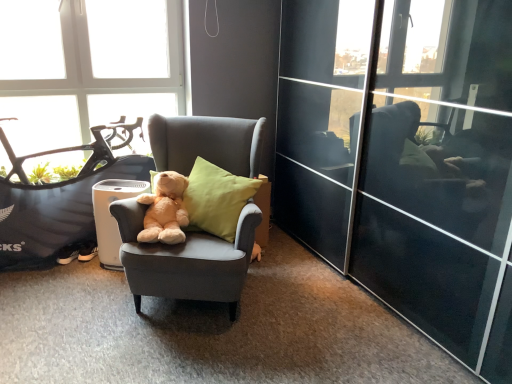
Question: Is transparent glass window at upper left inside the boundaries of matte gray armchair at center, or outside?

Choices:
 (A) outside
 (B) inside

Answer: (A)

Question: Looking at their shapes, would you say transparent glass window at upper left is wider or thinner than matte gray armchair at center?

Choices:
 (A) thin
 (B) wide

Answer: (A)

Question: Considering the real-world distances, which object is closest to the transparent glass window at upper left?

Choices:
 (A) black matte mountain bike at left
 (B) transparent glass screen door at center
 (C) matte gray armchair at center
 (D) soft yellow cushion at center
 (E) soft plush teddy bear at center

Answer: (A)

Question: Estimate the real-world distances between objects in this image. Which object is farther from the black matte mountain bike at left?

Choices:
 (A) transparent glass window at upper left
 (B) soft yellow cushion at center
 (C) matte gray armchair at center
 (D) soft plush teddy bear at center
 (E) transparent glass screen door at center

Answer: (E)